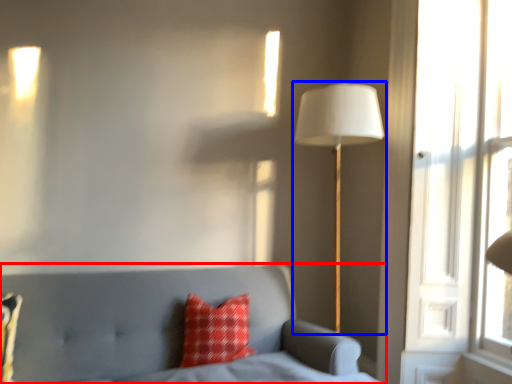
Question: Which of the following is the closest to the observer, furniture (highlighted by a red box) or lamp (highlighted by a blue box)?

Choices:
 (A) furniture
 (B) lamp

Answer: (A)